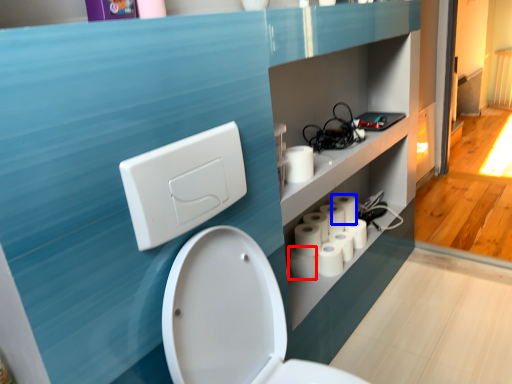
Question: Which object is further to the camera taking this photo, toilet paper (highlighted by a red box) or toilet paper (highlighted by a blue box)?

Choices:
 (A) toilet paper
 (B) toilet paper

Answer: (B)